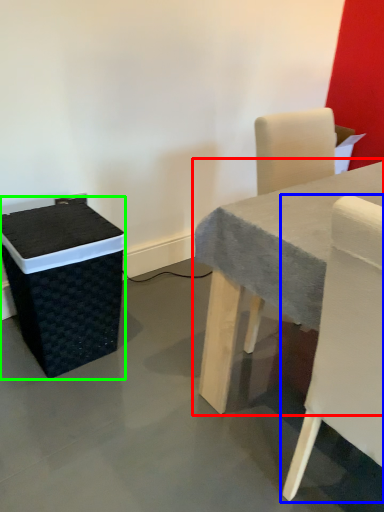
Question: Which object is the closest to the table (highlighted by a red box)? Choose among these: chair (highlighted by a blue box) or storage box (highlighted by a green box).

Choices:
 (A) chair
 (B) storage box

Answer: (A)